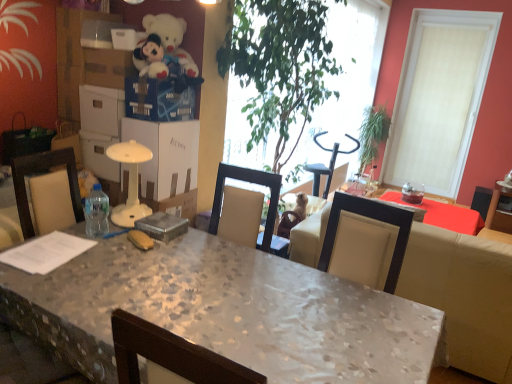
This screenshot has width=512, height=384. Describe the element at coordinates (439, 96) in the screenshot. I see `white textured window at upper right` at that location.

What do you see at coordinates (162, 226) in the screenshot? I see `metallic gray box at center` at bounding box center [162, 226].

Find the location of a particular element. This screenshot has width=512, height=384. beige leather couch at center is located at coordinates (463, 295).

From the image's perspective, does white cardboard box at center appear higher than white textured window at upper right?

No, from the image's perspective, white cardboard box at center is not on top of white textured window at upper right.

Between point (152, 133) and point (455, 95), which one is positioned behind?

The point (455, 95) is behind.

From the picture: Is white cardboard box at center oriented towards white textured window at upper right?

No, white cardboard box at center is not aimed at white textured window at upper right.

Which of these two, white cardboard box at center or white textured window at upper right, stands shorter?

Standing shorter between the two is white cardboard box at center.

You are a GUI agent. You are given a task and a screenshot of the screen. Output one action in this format:
    pyautogui.click(x=<x>, y=<y>)
    Task: Click on the box behind the clear plastic bottle at table left
    
    Given the screenshot: What is the action you would take?
    pyautogui.click(x=162, y=226)

Is clear plastic bottle at table left surrounding metallic gray box at center?

Definitely not — metallic gray box at center is not inside clear plastic bottle at table left.

Is clear plastic bottle at table left taller or shorter than metallic gray box at center?

clear plastic bottle at table left is taller than metallic gray box at center.

Is clear plastic bottle at table left positioned far away from metallic gray box at center?

No, clear plastic bottle at table left is not far from metallic gray box at center.

Is green leafy plant at upper right, the second houseplant positioned from the left, next to marble textured desk at center and touching it?

There is a gap between green leafy plant at upper right, the second houseplant positioned from the left, and marble textured desk at center.

Is green leafy plant at upper right, the second houseplant positioned from the left, surrounding marble textured desk at center?

No, marble textured desk at center is not inside green leafy plant at upper right, the second houseplant positioned from the left.

Does point (379, 139) appear closer or farther from the camera than point (358, 340)?

Point (379, 139) is positioned farther from the camera compared to point (358, 340).

What's the angular difference between green leafy plant at upper right, the second houseplant positioned from the left, and marble textured desk at center's facing directions?

0.184 degrees separate the facing orientations of green leafy plant at upper right, the second houseplant positioned from the left, and marble textured desk at center.

Does beige leather couch at center turn towards metallic gray box at center?

No, beige leather couch at center does not turn towards metallic gray box at center.

Consider the image. Is metallic gray box at center a part of beige leather couch at center?

That's incorrect, metallic gray box at center is not inside beige leather couch at center.

Measure the distance between beige leather couch at center and metallic gray box at center.

1.38 meters.

Consider the image. Is there a large distance between beige leather couch at center and metallic gray box at center?

Absolutely, beige leather couch at center is distant from metallic gray box at center.

Would you consider green leafy plant at upper right, which ranks as the first houseplant in back-to-front order, to be distant from white textured window at upper right?

No, there isn't a large distance between green leafy plant at upper right, which ranks as the first houseplant in back-to-front order, and white textured window at upper right.

From the picture: Does green leafy plant at upper right, the second houseplant positioned from the left, appear on the right side of white textured window at upper right?

No, green leafy plant at upper right, the second houseplant positioned from the left, is not to the right of white textured window at upper right.

Is green leafy plant at upper right, the second houseplant positioned from the left, positioned with its back to white textured window at upper right?

That's not correct — green leafy plant at upper right, the second houseplant positioned from the left, is not looking away from white textured window at upper right.

Where is `window in front of the green leafy plant at upper right, which ranks as the first houseplant in right-to-left order`? The image size is (512, 384). window in front of the green leafy plant at upper right, which ranks as the first houseplant in right-to-left order is located at coordinates (439, 96).

Between green leafy plant at upper right, positioned as the second houseplant in front-to-back order, and beige leather couch at center, which one has smaller width?

green leafy plant at upper right, positioned as the second houseplant in front-to-back order.

Is green leafy plant at upper right, positioned as the second houseplant in front-to-back order, next to beige leather couch at center?

No.

From a real-world perspective, which object rests below the other?

beige leather couch at center, from a real-world perspective.

Considering the sizes of objects metallic gray box at center and white textured window at upper right in the image provided, who is bigger, metallic gray box at center or white textured window at upper right?

With larger size is white textured window at upper right.

Which is less distant, (x=161, y=213) or (x=406, y=48)?

The point (x=161, y=213) is closer to the camera.

You are a GUI agent. You are given a task and a screenshot of the screen. Output one action in this format:
    pyautogui.click(x=<x>, y=<y>)
    Task: Click on the box in front of the white textured window at upper right
    The height and width of the screenshot is (384, 512).
    Given the screenshot: What is the action you would take?
    pyautogui.click(x=162, y=226)

Identify the location of window that appears on the right of white cardboard box at center. (439, 96).

At what (x,y) coordinates should I click in order to perform the action: click on bottle positioned vertically above the metallic gray box at center (from a real-world perspective). Please return your answer as a coordinate pair (x, y). The image size is (512, 384). Looking at the image, I should click on (96, 212).

Looking at the image, which one is located further to white plush teddy bear at upper left, white cardboard box at center or marble textured desk at center?

marble textured desk at center.

Considering their positions, is beige leather couch at center positioned closer to green leafy plant at center, which is counted as the 1th houseplant, starting from the front, than metallic gray box at center?

metallic gray box at center is closer to green leafy plant at center, which is counted as the 1th houseplant, starting from the front.

In the scene shown: Based on their spatial positions, is white plush teddy bear at upper left or green leafy plant at upper right, positioned as the second houseplant in front-to-back order, closer to clear plastic bottle at table left?

white plush teddy bear at upper left is closer to clear plastic bottle at table left.

Considering their positions, is green leafy plant at upper right, the second houseplant positioned from the left, positioned further to metallic gray box at center than white plush teddy bear at upper left?

Among the two, green leafy plant at upper right, the second houseplant positioned from the left, is located further to metallic gray box at center.

When comparing their distances from white plush teddy bear at upper left, does white cardboard box at center or white textured window at upper right seem closer?

Based on the image, white cardboard box at center appears to be nearer to white plush teddy bear at upper left.

When comparing their distances from clear plastic bottle at table left, does metallic gray box at center or marble textured desk at center seem further?

marble textured desk at center is further to clear plastic bottle at table left.

Which object lies further to the anchor point clear plastic bottle at table left, green leafy plant at upper right, which ranks as the first houseplant in back-to-front order, or metallic gray box at center?

Based on the image, green leafy plant at upper right, which ranks as the first houseplant in back-to-front order, appears to be further to clear plastic bottle at table left.

Which object lies nearer to the anchor point green leafy plant at center, which is counted as the 1th houseplant, starting from the front, metallic gray box at center or white plush teddy bear at upper left?

white plush teddy bear at upper left is positioned closer to the anchor green leafy plant at center, which is counted as the 1th houseplant, starting from the front.

This screenshot has width=512, height=384. Find the location of `window between white plush teddy bear at upper left and green leafy plant at upper right, positioned as the second houseplant in front-to-back order, from front to back`. window between white plush teddy bear at upper left and green leafy plant at upper right, positioned as the second houseplant in front-to-back order, from front to back is located at coordinates (439, 96).

What are the coordinates of `teddy bear positioned between metallic gray box at center and white textured window at upper right from near to far` in the screenshot? It's located at (170, 37).

Find the location of a particular element. This screenshot has width=512, height=384. teddy bear between white cardboard box at center and green leafy plant at center, positioned as the 2th houseplant in back-to-front order, from left to right is located at coordinates (170, 37).

At what (x,y) coordinates should I click in order to perform the action: click on teddy bear between beige leather couch at center and green leafy plant at upper right, which ranks as the first houseplant in right-to-left order, along the z-axis. Please return your answer as a coordinate pair (x, y). The width and height of the screenshot is (512, 384). Looking at the image, I should click on (170, 37).